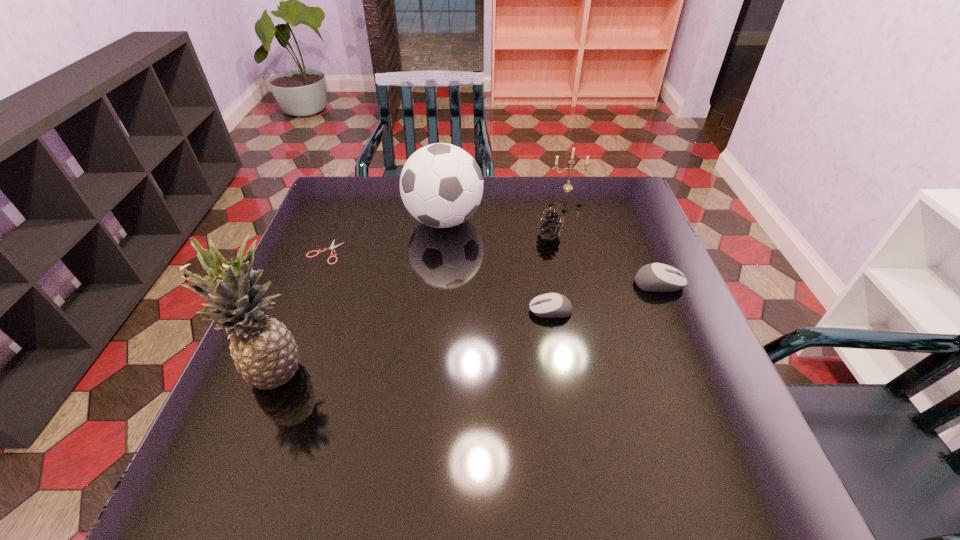
The height and width of the screenshot is (540, 960). I want to click on candle that is at the far edge, so click(568, 186).

You are a GUI agent. You are given a task and a screenshot of the screen. Output one action in this format:
    pyautogui.click(x=<x>, y=<y>)
    Task: Click on the soccer ball that is at the far edge
    Image resolution: width=960 pixels, height=540 pixels.
    Given the screenshot: What is the action you would take?
    pyautogui.click(x=441, y=185)

Identify the location of object situated at the near edge. (265, 353).

You are a GUI agent. You are given a task and a screenshot of the screen. Output one action in this format:
    pyautogui.click(x=<x>, y=<y>)
    Task: Click on the shears that is positioned at the left edge
    
    Given the screenshot: What is the action you would take?
    [x=332, y=246]

Where is `pineapple present at the left edge`? This screenshot has width=960, height=540. pineapple present at the left edge is located at coordinates (x=265, y=353).

Locate an element on the screen. This screenshot has width=960, height=540. computer equipment at the right edge is located at coordinates (656, 277).

Find the location of a particular element. This screenshot has height=540, width=960. candle at the right edge is located at coordinates (568, 186).

The image size is (960, 540). Identify the location of object at the near left corner. (265, 353).

Locate an element on the screen. object that is at the far right corner is located at coordinates (568, 186).

Identify the location of vacant space at the far edge. (541, 198).